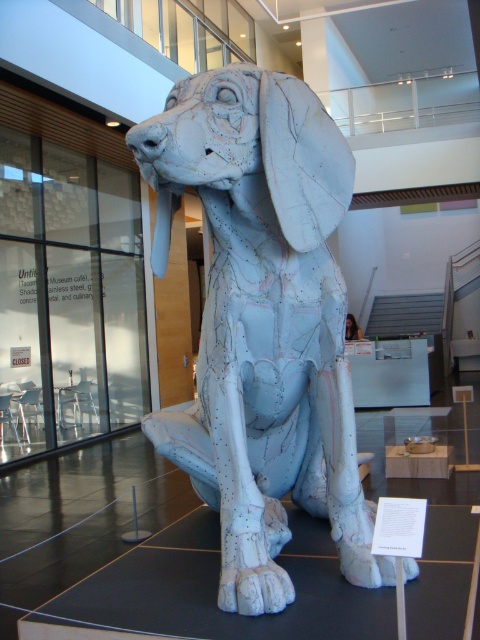
Question: Is white matte sculpture at center bigger than white matte tusk at center?

Choices:
 (A) yes
 (B) no

Answer: (A)

Question: Is white matte sculpture at center positioned before white matte tusk at center?

Choices:
 (A) no
 (B) yes

Answer: (B)

Question: Among these points, which one is farthest from the camera?

Choices:
 (A) (164, 273)
 (B) (156, 125)

Answer: (A)

Question: Which object is farther from the camera taking this photo?

Choices:
 (A) white matte tusk at center
 (B) white matte sculpture at center

Answer: (A)

Question: Which object appears farthest from the camera in this image?

Choices:
 (A) white matte sculpture at center
 (B) white matte tusk at center

Answer: (B)

Question: In this image, where is white matte sculpture at center located relative to white matte tusk at center?

Choices:
 (A) below
 (B) above

Answer: (A)